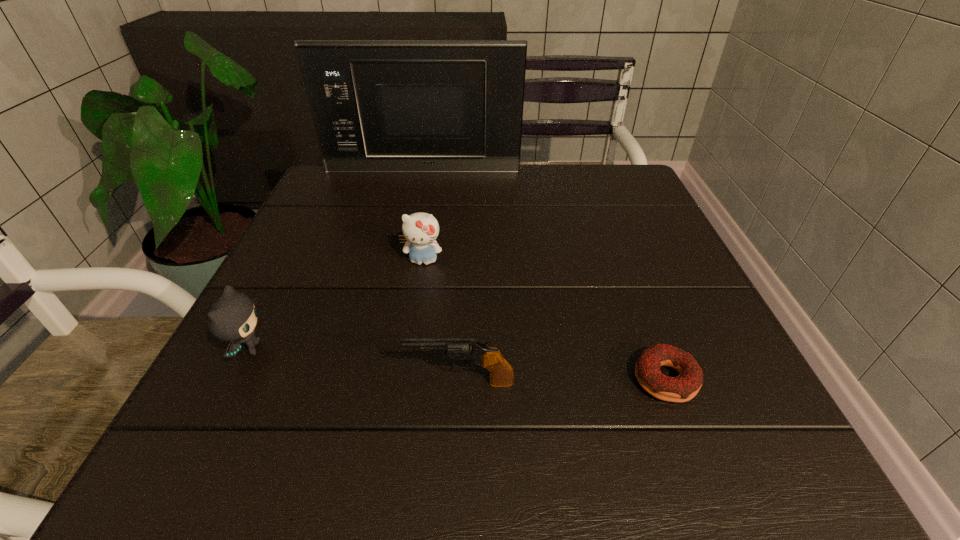
Identify the location of vacant area in the image that satisfies the following two spatial constraints: 1. on the front panel of the tallest object; 2. on the front-facing side of the left kitten. This screenshot has width=960, height=540. [387, 349].

This screenshot has width=960, height=540. In order to click on vacant point that satisfies the following two spatial constraints: 1. on the front-facing side of the right kitten; 2. along the barrel of the gun in this screenshot , I will do `click(404, 382)`.

Image resolution: width=960 pixels, height=540 pixels. I want to click on free space that satisfies the following two spatial constraints: 1. on the front panel of the farthest object; 2. along the barrel of the gun, so click(380, 382).

Locate an element on the screen. The height and width of the screenshot is (540, 960). vacant space that satisfies the following two spatial constraints: 1. on the front panel of the farthest object; 2. on the front-facing side of the nearer kitten is located at coordinates (387, 349).

Locate an element on the screen. This screenshot has width=960, height=540. free spot that satisfies the following two spatial constraints: 1. along the barrel of the shortest object; 2. on the left side of the gun is located at coordinates (460, 380).

Find the location of a particular element. This screenshot has height=540, width=960. free space that satisfies the following two spatial constraints: 1. along the barrel of the gun; 2. on the front-facing side of the farther kitten is located at coordinates (465, 261).

The height and width of the screenshot is (540, 960). Identify the location of vacant space that satisfies the following two spatial constraints: 1. along the barrel of the gun; 2. on the left side of the rightmost object. (460, 380).

Identify the location of free space that satisfies the following two spatial constraints: 1. on the front panel of the microwave oven; 2. on the front-facing side of the left kitten. The image size is (960, 540). (387, 349).